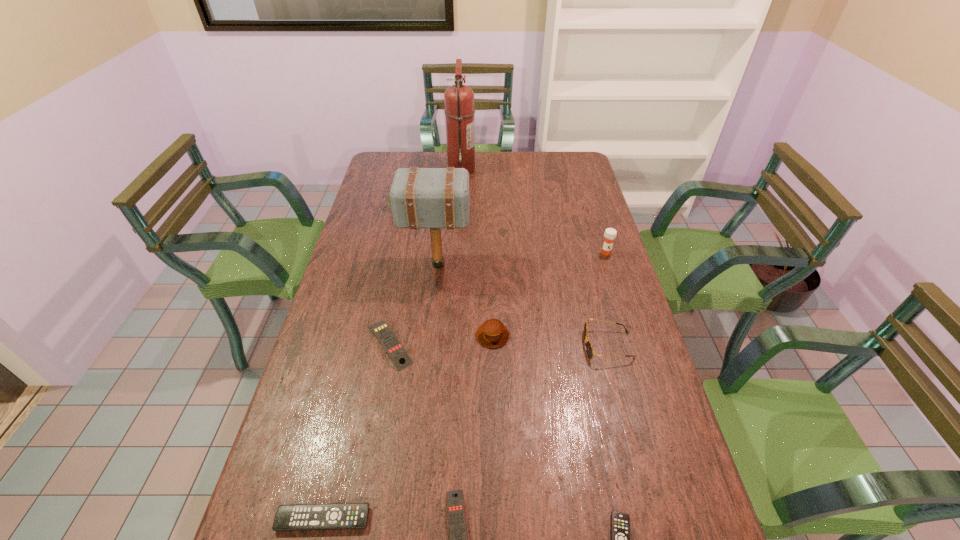
Find the location of `free space at the right edge of the desktop`. free space at the right edge of the desktop is located at coordinates (561, 187).

Find the location of `free space between the sunglasses and the brown muffin`. free space between the sunglasses and the brown muffin is located at coordinates pos(550,340).

This screenshot has height=540, width=960. I want to click on empty location between the mallet and the medicine, so click(521, 259).

Find the location of a particular element. Image resolution: width=960 pixels, height=540 pixels. vacant space that is in between the fifth tallest object and the black sunglasses is located at coordinates (550, 340).

The image size is (960, 540). Find the location of `free area in between the bigger black remote control and the second farthest object`. free area in between the bigger black remote control and the second farthest object is located at coordinates (361, 364).

Where is `free space between the mallet and the avocado`? The width and height of the screenshot is (960, 540). free space between the mallet and the avocado is located at coordinates (418, 237).

What are the coordinates of `vacant space that is in between the black sunglasses and the farthest object` in the screenshot? It's located at (535, 257).

The image size is (960, 540). Find the location of `the second closest object to the shortest object`. the second closest object to the shortest object is located at coordinates (589, 348).

Identify which object is located as the fourth nearest to the medicine. Please provide its 2D coordinates. Your answer should be formatted as a tuple, i.e. [(x, y)], where the tuple contains the x and y coordinates of a point satisfying the conditions above.

[(459, 111)]

Image resolution: width=960 pixels, height=540 pixels. Identify the location of remote control that is the fourth closest to the black sunglasses. (335, 516).